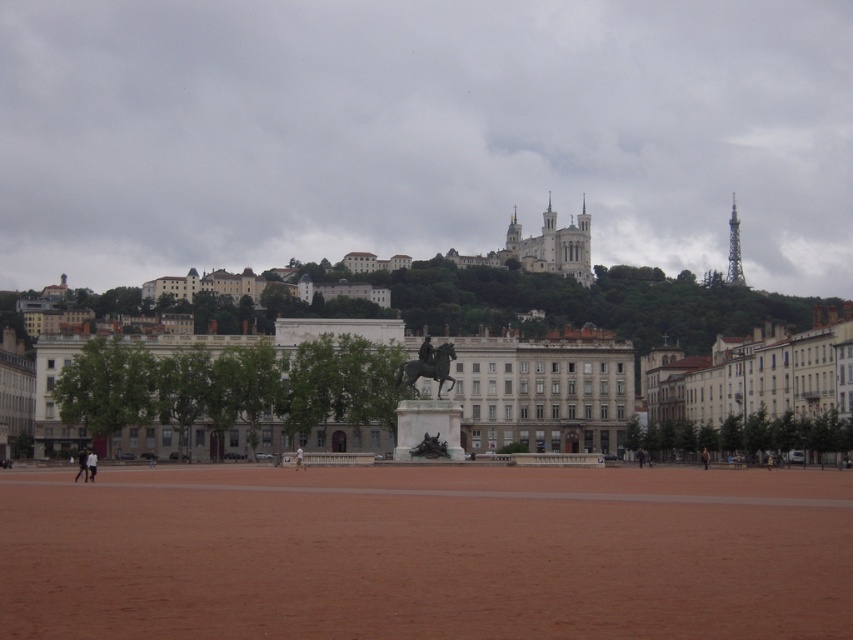
Is point (498, 509) positioned after point (585, 257)?

No, (498, 509) is in front of (585, 257).

Does brown dirt field at center come in front of white stone castle at upper center?

Yes.

Who is more distant from viewer, (799,538) or (521,244)?

The point (521,244) is behind.

Where is `brown dirt field at center`? This screenshot has height=640, width=853. brown dirt field at center is located at coordinates (427, 554).